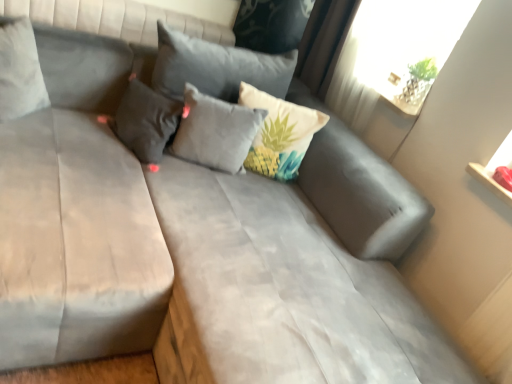
Question: Would you say suede gray mattress at center, the 1th mattress when ordered from right to left, is to the left or to the right of dark gray fabric pillow at upper left, the second pillow viewed from the left, in the picture?

Choices:
 (A) right
 (B) left

Answer: (A)

Question: From the image's perspective, is suede gray mattress at center, the second mattress from the left, positioned above or below dark gray fabric pillow at upper left, the second pillow viewed from the left?

Choices:
 (A) below
 (B) above

Answer: (A)

Question: Which object is positioned farthest from the dark gray fabric pillow at upper left, the second pillow viewed from the left?

Choices:
 (A) suede gray mattress at center, the second mattress from the left
 (B) suede gray mattress at left, the 1th mattress when ordered from left to right
 (C) light gray fabric pillow at center, which is the third pillow from left to right
 (D) beige fabric pillow with tropical print at center, the 4th pillow when ordered from left to right
 (E) suede gray pillow at upper left, marked as the 4th pillow in a right-to-left arrangement

Answer: (A)

Question: Considering the real-world distances, which object is closest to the light gray fabric pillow at center, which is the third pillow from left to right?

Choices:
 (A) transparent glass window screen at upper right
 (B) dark gray fabric pillow at upper left, placed as the 3th pillow when sorted from right to left
 (C) beige fabric pillow with tropical print at center, acting as the first pillow starting from the right
 (D) suede gray mattress at center, the 1th mattress when ordered from right to left
 (E) suede gray pillow at upper left, marked as the 4th pillow in a right-to-left arrangement

Answer: (B)